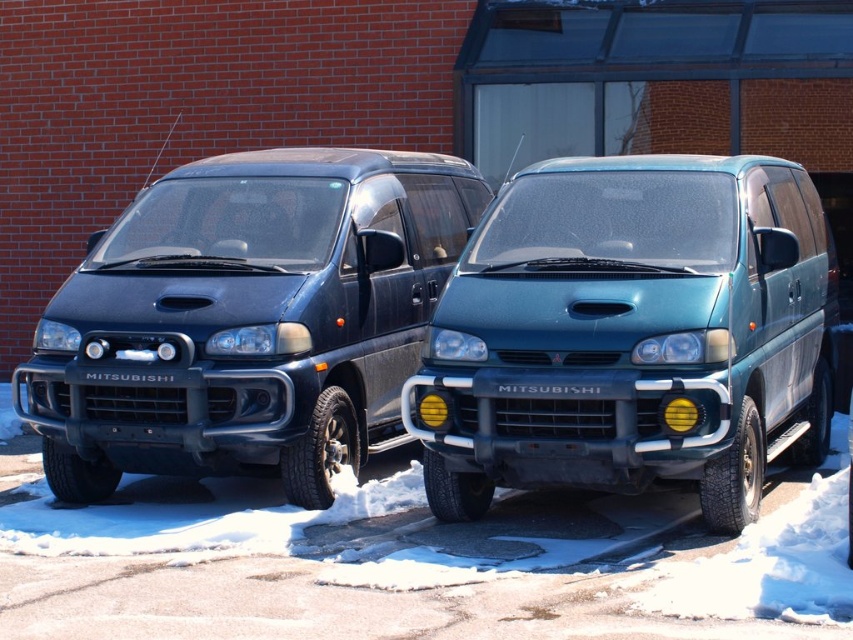
Is point (689, 250) farther from camera compared to point (194, 323)?

No, it is in front of (194, 323).

Measure the distance between point (558,164) and camera.

Point (558,164) is 7.88 meters from camera.

Find the location of a particular element. The width and height of the screenshot is (853, 640). teal matte van at center is located at coordinates (630, 333).